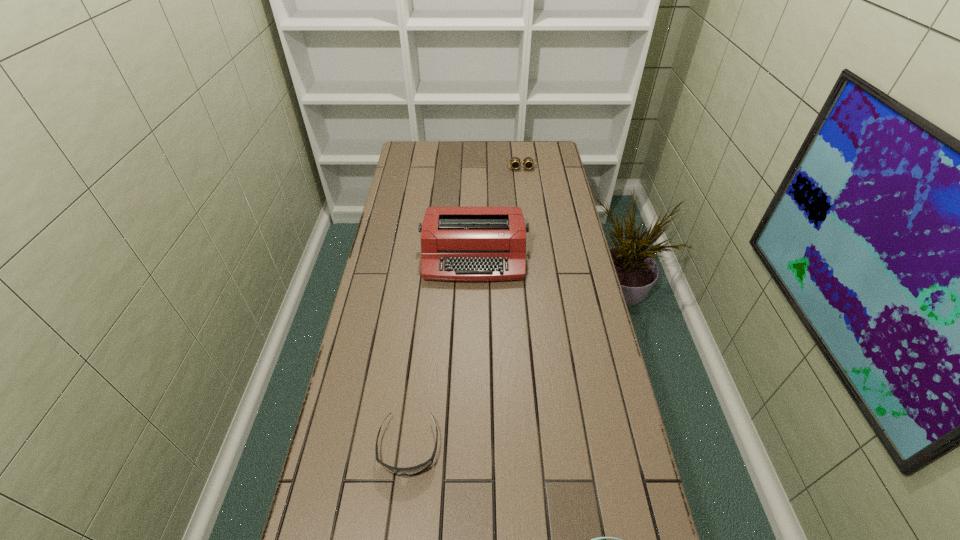
The width and height of the screenshot is (960, 540). Find the location of `goggles that is at the left edge`. goggles that is at the left edge is located at coordinates (408, 471).

Where is `object that is at the right edge`? Image resolution: width=960 pixels, height=540 pixels. object that is at the right edge is located at coordinates (515, 162).

The width and height of the screenshot is (960, 540). Identify the location of object present at the far right corner. tap(515, 162).

Find the location of a particular element. Image resolution: width=960 pixels, height=540 pixels. vacant space at the far edge of the desktop is located at coordinates (438, 165).

In the image, there is a desktop. At what (x,y) coordinates should I click in order to perform the action: click on vacant space at the left edge. Please return your answer as a coordinate pair (x, y). The height and width of the screenshot is (540, 960). Looking at the image, I should click on (348, 463).

Where is `free location at the right edge`? free location at the right edge is located at coordinates (540, 213).

Image resolution: width=960 pixels, height=540 pixels. In order to click on vacant space in between the typewriter and the second farthest goggles in this screenshot , I will do `click(442, 351)`.

Identify the location of empty space between the second nearest object and the farthest goggles. (465, 307).

Where is `vacant space that's between the third farthest object and the second farthest object`? This screenshot has width=960, height=540. vacant space that's between the third farthest object and the second farthest object is located at coordinates (442, 351).

Find the location of a particular element. Image resolution: width=960 pixels, height=540 pixels. empty location between the leftmost goggles and the typewriter is located at coordinates (x=442, y=351).